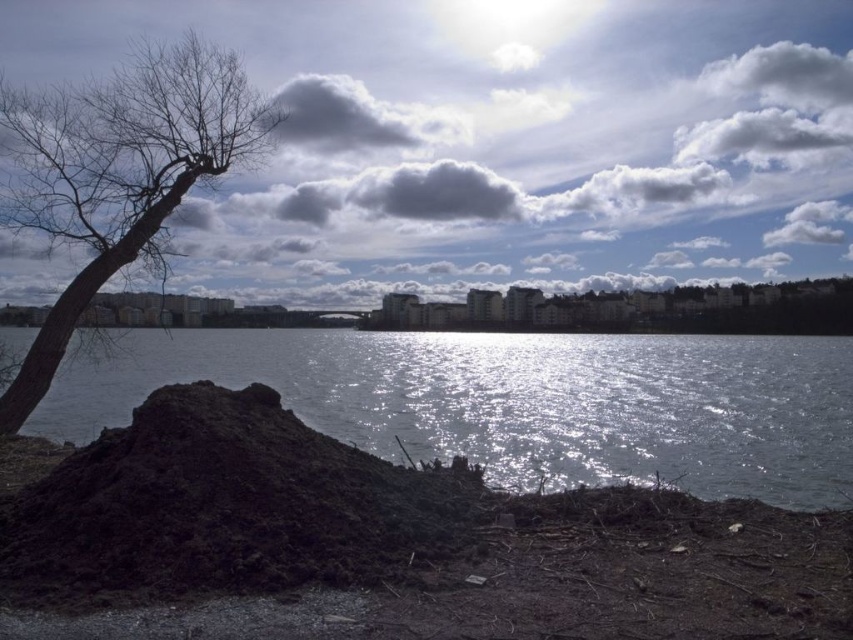
You are a landscape architect planning to plant a new tree. You see the dark soil mound at lower left and the bare wood tree at left. Which object is larger in size?

The dark soil mound at lower left is smaller than the bare wood tree at left, so the bare wood tree at left is larger in size.

You are an architect designing a new building and want to ensure it fits well with the existing riverside landscape. The scene includes a cloudy sky at upper center and a dark soil mound at lower left. Which of these two elements should you consider larger in your design to match the scene?

The cloudy sky at upper center is bigger than the dark soil mound at lower left, so you should design the cloudy sky at upper center to be larger in your plan to match the scene.

You are a photographer wanting to capture the entire view of the glistening water at center and the bare wood tree at left in one shot. Based on the scene, which object occupies more horizontal space in the image?

The glistening water at center occupies more horizontal space because its width is larger than the bare wood tree at left.